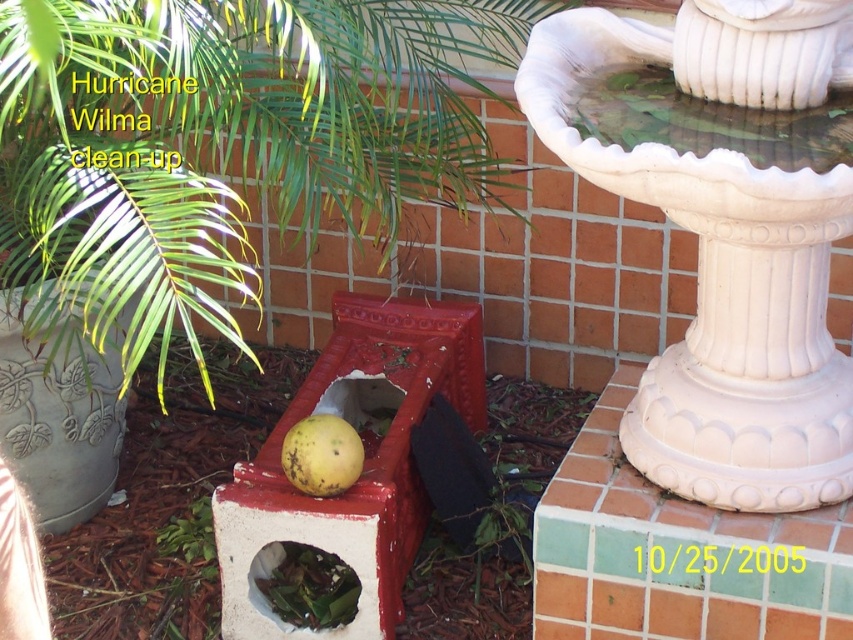
You are a gardener looking at the garden scene after Hurricane Wilma. You see a point marked at coordinate (229, 134). What is this point located on?

The point marked at coordinate (229, 134) is located on the green leafy plant at center.

You are a gardener assessing the damage after Hurricane Wilma. You notice the white ceramic fountain at upper right and the yellow matte fruit at center. Which object is taller?

The white ceramic fountain at upper right is taller than the yellow matte fruit at center.

You are a gardener assessing the damage after Hurricane Wilma. You notice a green leafy plant at center near the point marked at coordinates (x=229, y=134). What is the condition of the green leafy plant at center?

The green leafy plant at center is lying at the point marked at coordinates (x=229, y=134), indicating it has been knocked over by the hurricane.